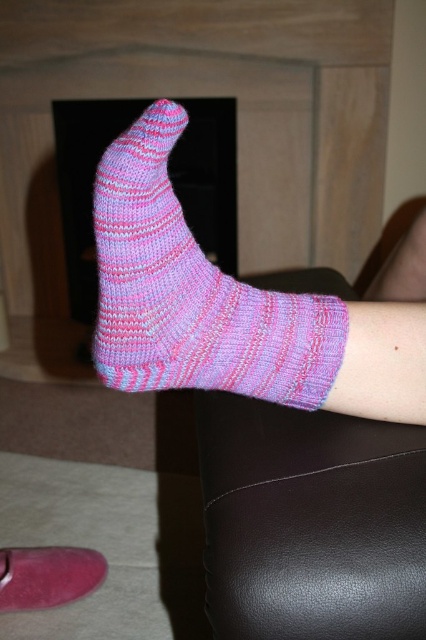
Question: Which point is farther to the camera?

Choices:
 (A) pink knitted sock at lower center
 (B) purple knitted sock at lower center

Answer: (A)

Question: Based on their relative distances, which object is nearer to the purple knitted sock at lower center?

Choices:
 (A) pink knitted sock at lower center
 (B) pink knitted sock at center

Answer: (B)

Question: Considering the relative positions of purple knitted sock at lower center and pink knitted sock at lower center in the image provided, where is purple knitted sock at lower center located with respect to pink knitted sock at lower center?

Choices:
 (A) below
 (B) above

Answer: (B)

Question: Observing the image, what is the correct spatial positioning of purple knitted sock at lower center in reference to pink knitted sock at center?

Choices:
 (A) below
 (B) above

Answer: (A)

Question: Is purple knitted sock at lower center further to the viewer compared to pink knitted sock at center?

Choices:
 (A) no
 (B) yes

Answer: (A)

Question: Which of the following is the farthest from the observer?

Choices:
 (A) (345, 577)
 (B) (46, 548)
 (C) (296, 308)

Answer: (B)